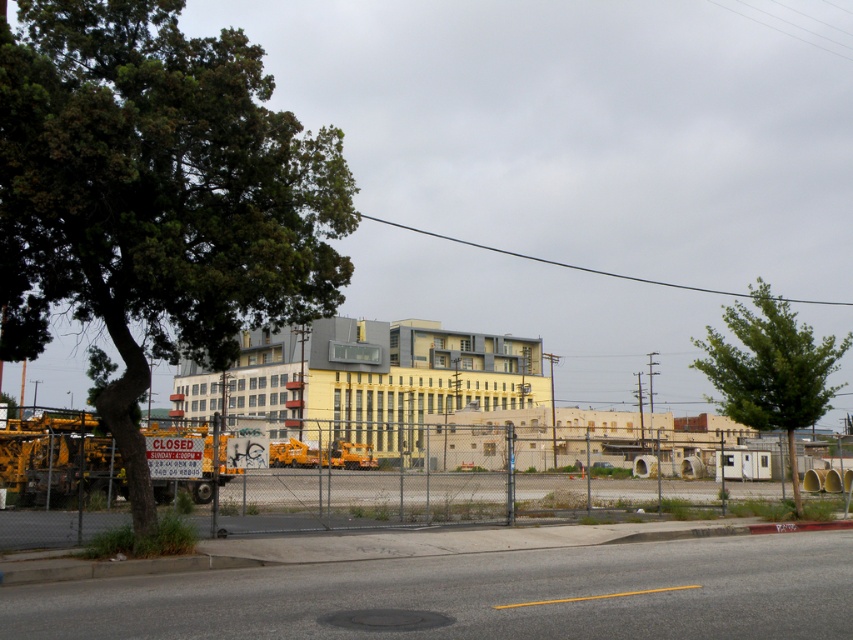
Is green leafy tree at lower right bigger than yellow matte school bus at center?

Correct, green leafy tree at lower right is larger in size than yellow matte school bus at center.

Is green leafy tree at lower right thinner than yellow matte school bus at center?

No.

Does point (712, 336) come in front of point (317, 454)?

No, (712, 336) is further to viewer.

At what (x,y) coordinates should I click in order to perform the action: click on green leafy tree at lower right. Please return your answer as a coordinate pair (x, y). The height and width of the screenshot is (640, 853). Looking at the image, I should click on (770, 369).

Is green leafy tree at left thinner than green leafy tree at lower right?

Indeed, green leafy tree at left has a lesser width compared to green leafy tree at lower right.

Is green leafy tree at left taller than green leafy tree at lower right?

No.

Between point (183, 332) and point (766, 380), which one is positioned in front?

Point (183, 332)

Where is `green leafy tree at left`? This screenshot has height=640, width=853. green leafy tree at left is located at coordinates (x=155, y=196).

Is green leafy tree at left taller than yellow matte school bus at center?

Indeed, green leafy tree at left has a greater height compared to yellow matte school bus at center.

Which is in front, point (160, 92) or point (292, 449)?

Point (160, 92) is more forward.

Where is `green leafy tree at left`? The image size is (853, 640). green leafy tree at left is located at coordinates (155, 196).